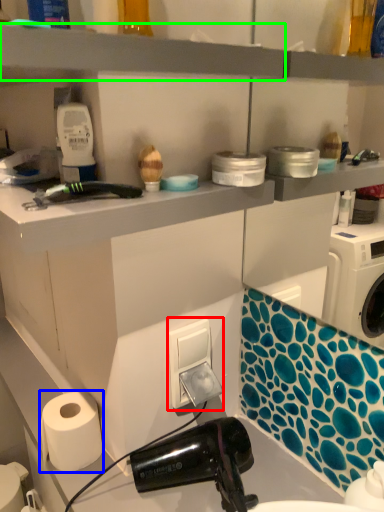
Question: Based on their relative distances, which object is nearer to electric outlet (highlighted by a red box)? Choose from paper towel (highlighted by a blue box) and shelf (highlighted by a green box).

Choices:
 (A) paper towel
 (B) shelf

Answer: (A)